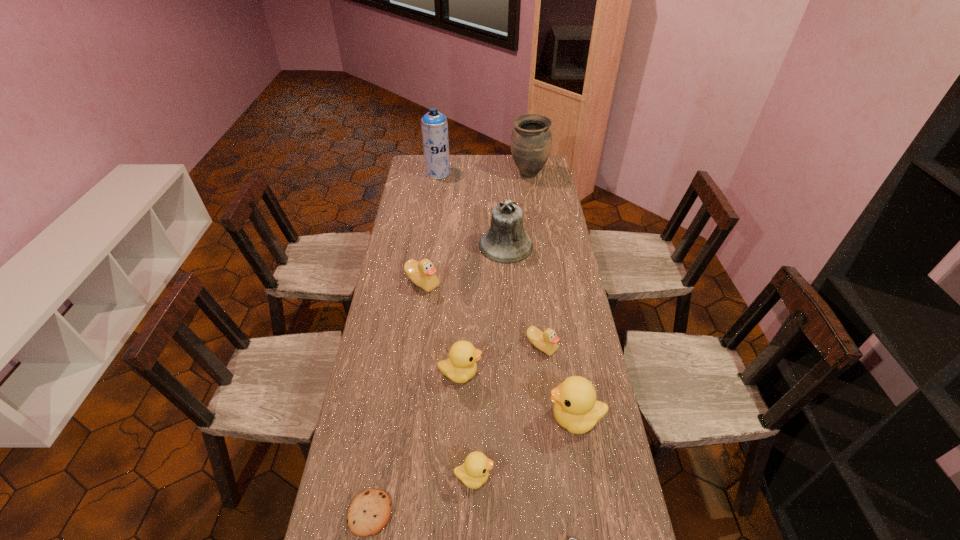
The height and width of the screenshot is (540, 960). What are the coordinates of `vacant area that satisfies the following two spatial constraints: 1. on the front side of the urn; 2. on the face of the smallest yellow duck` in the screenshot? It's located at (574, 477).

In order to click on free spot that satisfies the following two spatial constraints: 1. at the beak of the second farthest duck; 2. on the face of the smallest yellow duck in this screenshot , I will do `click(558, 477)`.

Find the location of a particular element. This screenshot has height=540, width=960. free space that satisfies the following two spatial constraints: 1. on the front side of the third tallest object; 2. on the face of the nearest duck is located at coordinates (521, 477).